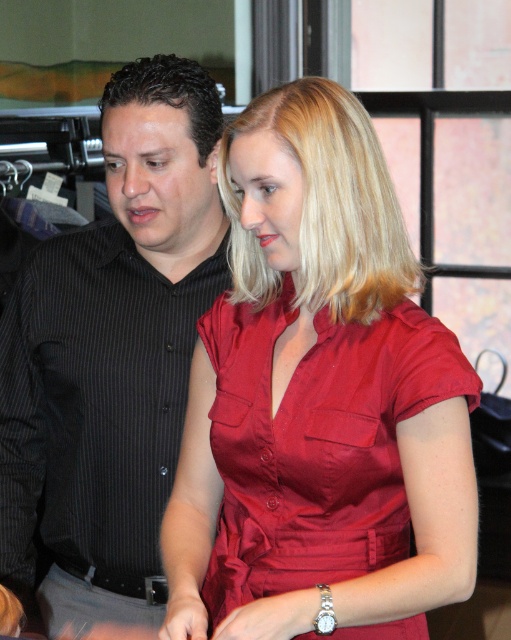
Question: Is black striped shirt at center positioned before shiny red blouse at center?

Choices:
 (A) yes
 (B) no

Answer: (B)

Question: Is black striped shirt at center below shiny red blouse at center?

Choices:
 (A) yes
 (B) no

Answer: (B)

Question: Can you confirm if black striped shirt at center is positioned to the right of shiny red blouse at center?

Choices:
 (A) no
 (B) yes

Answer: (A)

Question: Which object is closer to the camera taking this photo?

Choices:
 (A) black striped shirt at center
 (B) shiny red blouse at center

Answer: (B)